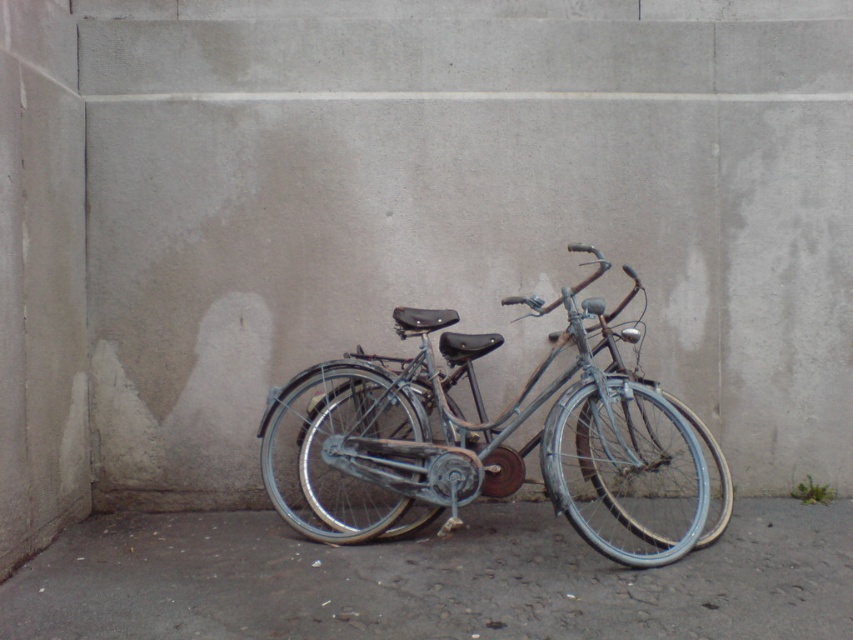
Between point (646, 589) and point (302, 448), which one is positioned in front?

Point (646, 589) is in front.

Can you confirm if gray concrete at lower center is shorter than blue metallic bicycle at center?

Correct, gray concrete at lower center is not as tall as blue metallic bicycle at center.

Where is `gray concrete at lower center`? The height and width of the screenshot is (640, 853). gray concrete at lower center is located at coordinates (432, 580).